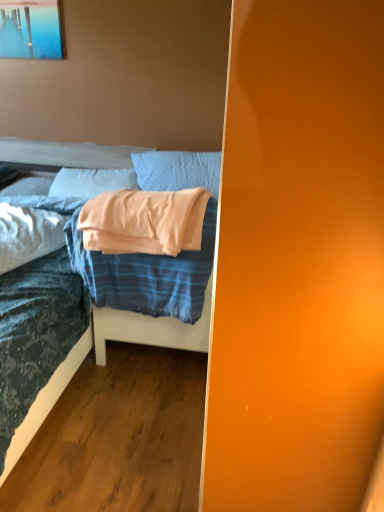
Question: Is white soft pillow at upper left, the 4th pillow positioned from the front, located outside peach soft fabric pillow at center, the 2th pillow positioned from the back?

Choices:
 (A) yes
 (B) no

Answer: (A)

Question: Considering the relative sizes of white soft pillow at upper left, the 4th pillow positioned from the front, and peach soft fabric pillow at center, the 3th pillow viewed from the front, in the image provided, is white soft pillow at upper left, the 4th pillow positioned from the front, smaller than peach soft fabric pillow at center, the 3th pillow viewed from the front,?

Choices:
 (A) yes
 (B) no

Answer: (A)

Question: Can you confirm if white soft pillow at upper left, arranged as the 1th pillow when viewed from the back, is taller than peach soft fabric pillow at center, the 3th pillow viewed from the front?

Choices:
 (A) no
 (B) yes

Answer: (A)

Question: Can you confirm if white soft pillow at upper left, the 4th pillow positioned from the front, is positioned to the left of peach soft fabric pillow at center, the 2th pillow positioned from the back?

Choices:
 (A) no
 (B) yes

Answer: (B)

Question: Is peach soft fabric pillow at center, the 3th pillow viewed from the front, located within white soft pillow at upper left, arranged as the 1th pillow when viewed from the back?

Choices:
 (A) yes
 (B) no

Answer: (B)

Question: Considering the relative sizes of white soft pillow at upper left, the 4th pillow positioned from the front, and peach soft fabric pillow at center, the 3th pillow viewed from the front, in the image provided, is white soft pillow at upper left, the 4th pillow positioned from the front, bigger than peach soft fabric pillow at center, the 3th pillow viewed from the front,?

Choices:
 (A) yes
 (B) no

Answer: (B)

Question: From the image's perspective, is blue striped fabric blanket at center under light blue fabric pillow at upper center, the third pillow from the back?

Choices:
 (A) yes
 (B) no

Answer: (A)

Question: Is blue striped fabric blanket at center positioned behind light blue fabric pillow at upper center, the third pillow from the back?

Choices:
 (A) yes
 (B) no

Answer: (B)

Question: Does blue striped fabric blanket at center have a greater width compared to light blue fabric pillow at upper center, the third pillow from the back?

Choices:
 (A) yes
 (B) no

Answer: (A)

Question: Can you confirm if blue striped fabric blanket at center is smaller than light blue fabric pillow at upper center, arranged as the second pillow when viewed from the front?

Choices:
 (A) yes
 (B) no

Answer: (B)

Question: Is blue striped fabric blanket at center at the left side of light blue fabric pillow at upper center, the third pillow from the back?

Choices:
 (A) yes
 (B) no

Answer: (A)

Question: Is light blue fabric pillow at upper center, arranged as the second pillow when viewed from the front, completely or partially inside blue striped fabric blanket at center?

Choices:
 (A) yes
 (B) no

Answer: (B)

Question: Considering the relative sizes of metallic glossy picture frame at upper left and light blue fabric pillow at upper center, the third pillow from the back, in the image provided, is metallic glossy picture frame at upper left wider than light blue fabric pillow at upper center, the third pillow from the back,?

Choices:
 (A) yes
 (B) no

Answer: (B)